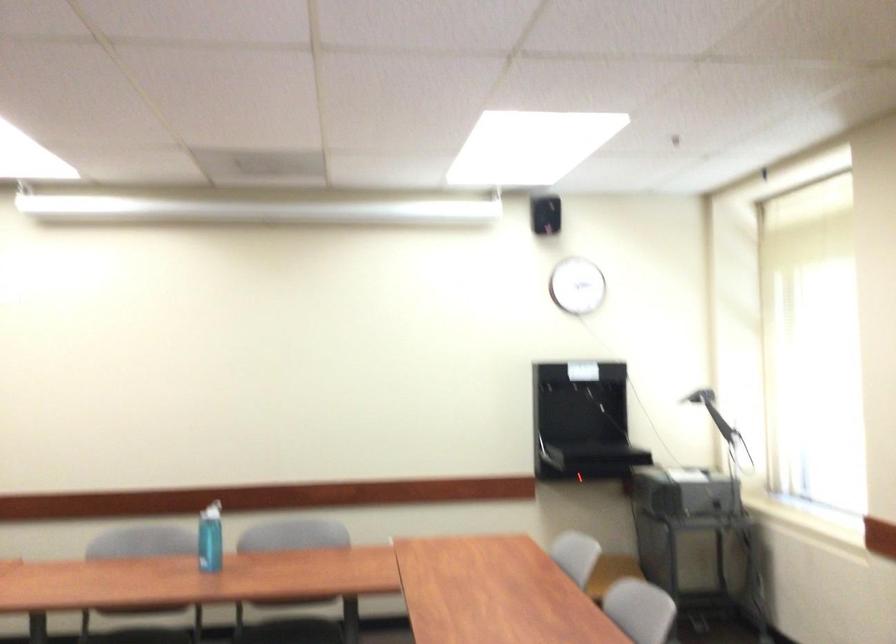
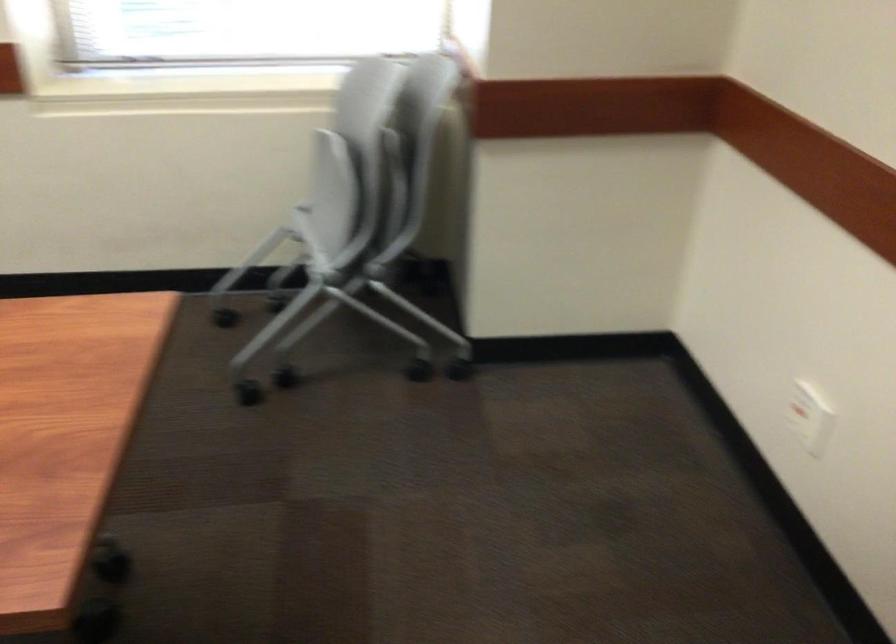
How did the camera likely rotate?

The camera's rotation is toward right-down.